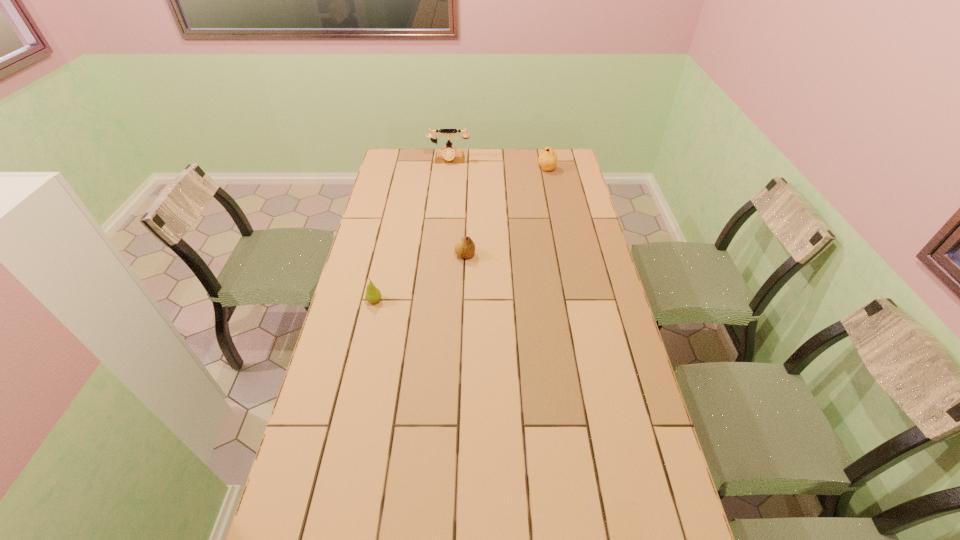
The width and height of the screenshot is (960, 540). Identify the location of pear that stands as the closest to the second nearest pear. (373, 294).

This screenshot has height=540, width=960. What are the coordinates of `free space that satisfies the following two spatial constraints: 1. on the dial of the second farthest pear; 2. on the right side of the tallest object` in the screenshot? It's located at (440, 255).

The image size is (960, 540). Find the location of `vacant region that satisfies the following two spatial constraints: 1. on the dial of the telephone; 2. on the left side of the rightmost pear`. vacant region that satisfies the following two spatial constraints: 1. on the dial of the telephone; 2. on the left side of the rightmost pear is located at coordinates (448, 170).

I want to click on free space that satisfies the following two spatial constraints: 1. on the back side of the farthest pear; 2. on the left side of the second nearest object, so click(468, 170).